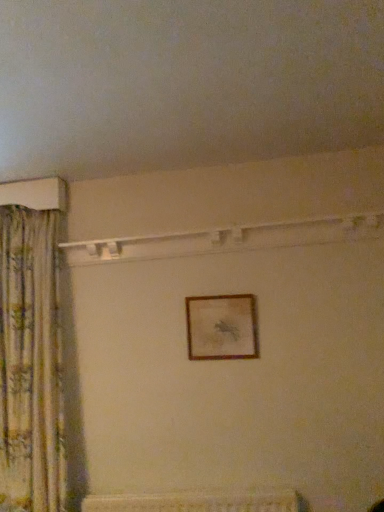
Question: From the image's perspective, relative to floral fabric curtain at left, is wooden picture frame at center above or below?

Choices:
 (A) below
 (B) above

Answer: (B)

Question: Considering the positions of wooden picture frame at center and floral fabric curtain at left in the image, is wooden picture frame at center bigger or smaller than floral fabric curtain at left?

Choices:
 (A) small
 (B) big

Answer: (A)

Question: Considering the positions of point (238, 331) and point (41, 350), is point (238, 331) closer or farther from the camera than point (41, 350)?

Choices:
 (A) farther
 (B) closer

Answer: (A)

Question: Which is correct: floral fabric curtain at left is inside wooden picture frame at center, or outside of it?

Choices:
 (A) inside
 (B) outside

Answer: (B)

Question: In terms of height, does floral fabric curtain at left look taller or shorter compared to wooden picture frame at center?

Choices:
 (A) tall
 (B) short

Answer: (A)

Question: Is point (31, 504) closer or farther from the camera than point (236, 312)?

Choices:
 (A) farther
 (B) closer

Answer: (B)

Question: From a real-world perspective, is floral fabric curtain at left physically located above or below wooden picture frame at center?

Choices:
 (A) above
 (B) below

Answer: (B)